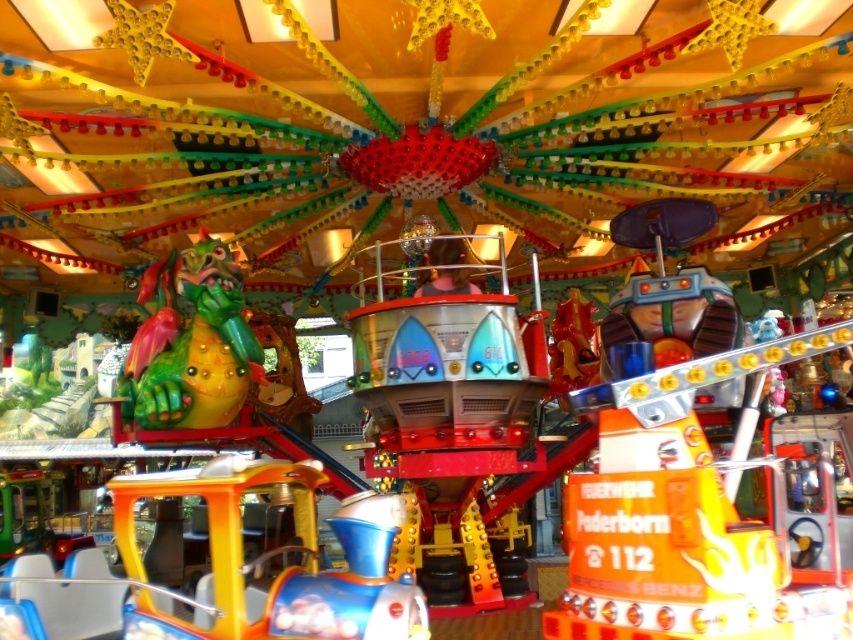
You are a parent trying to decide between two carousel rides for your child. The metallic blue spaceship at center and the green matte dragon at center are both in the center. Which one do you think is larger?

The metallic blue spaceship at center is bigger than the green matte dragon at center, so the metallic blue spaceship at center is larger.